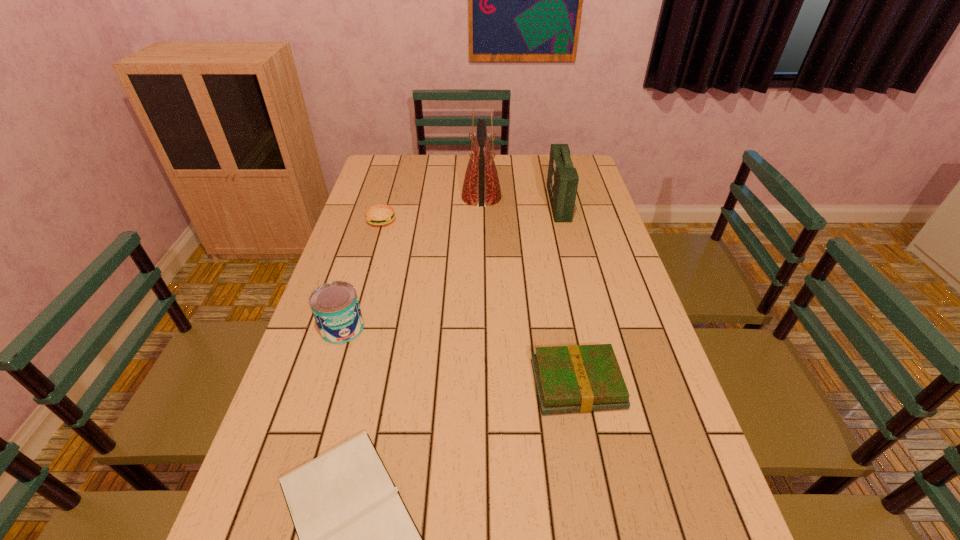
In the image, there is a desktop. Where is `vacant area at the left edge`? vacant area at the left edge is located at coordinates (372, 300).

You are a GUI agent. You are given a task and a screenshot of the screen. Output one action in this format:
    pyautogui.click(x=<x>, y=<y>)
    Task: Click on the free region at the right edge of the desktop
    The image size is (960, 540).
    Given the screenshot: What is the action you would take?
    pyautogui.click(x=615, y=247)

Identify the location of vacant space that is in between the fourth object from left to right and the book. (529, 291).

Locate an element on the screen. Image resolution: width=960 pixels, height=540 pixels. free space between the first-aid kit and the third nearest object is located at coordinates (450, 266).

The height and width of the screenshot is (540, 960). I want to click on vacant space that's between the first-aid kit and the can, so click(x=450, y=266).

At what (x,y) coordinates should I click in order to perform the action: click on free spot between the tallest object and the book. Please return your answer as a coordinate pair (x, y). Looking at the image, I should click on (529, 291).

At what (x,y) coordinates should I click in order to perform the action: click on free point between the patty and the fifth farthest object. Please return your answer as a coordinate pair (x, y). Looking at the image, I should click on (479, 302).

This screenshot has height=540, width=960. I want to click on empty location between the fifth farthest object and the tallest object, so click(x=529, y=291).

This screenshot has width=960, height=540. I want to click on free area in between the patty and the second nearest object, so [x=479, y=302].

Image resolution: width=960 pixels, height=540 pixels. I want to click on object identified as the fifth closest to the book, so click(x=380, y=214).